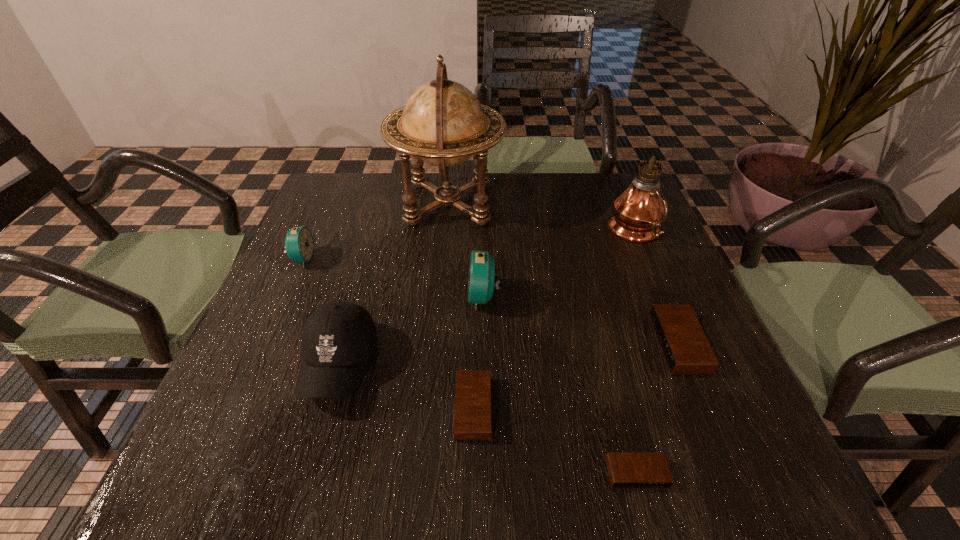
Where is `object at the far right corner`? The height and width of the screenshot is (540, 960). object at the far right corner is located at coordinates point(638,212).

The image size is (960, 540). I want to click on free space at the far edge, so click(491, 185).

The image size is (960, 540). What are the coordinates of `free point at the near edge` in the screenshot? It's located at (521, 489).

Where is `blank space at the left edge`? This screenshot has height=540, width=960. blank space at the left edge is located at coordinates (362, 231).

The image size is (960, 540). In the image, there is a desktop. Find the location of `free space at the far left corner`. free space at the far left corner is located at coordinates (315, 217).

In the image, there is a desktop. Identify the location of free space at the near left corner. (250, 449).

This screenshot has width=960, height=540. Identify the location of free region at the far right corner of the desktop. (590, 187).

Find the location of a particular element. This screenshot has width=960, height=540. free spot between the nearest black alarm clock and the left blue alarm clock is located at coordinates coord(469,366).

This screenshot has height=540, width=960. Find the location of `vacant area that lies between the globe and the second nearest black alarm clock`. vacant area that lies between the globe and the second nearest black alarm clock is located at coordinates (461, 305).

You are a GUI agent. You are given a task and a screenshot of the screen. Output one action in this format:
    pyautogui.click(x=<x>, y=<y>)
    Task: Click on the vacant space in between the rightmost black alarm clock and the smaller blue alarm clock
    This screenshot has width=960, height=540.
    Given the screenshot: What is the action you would take?
    pyautogui.click(x=491, y=301)